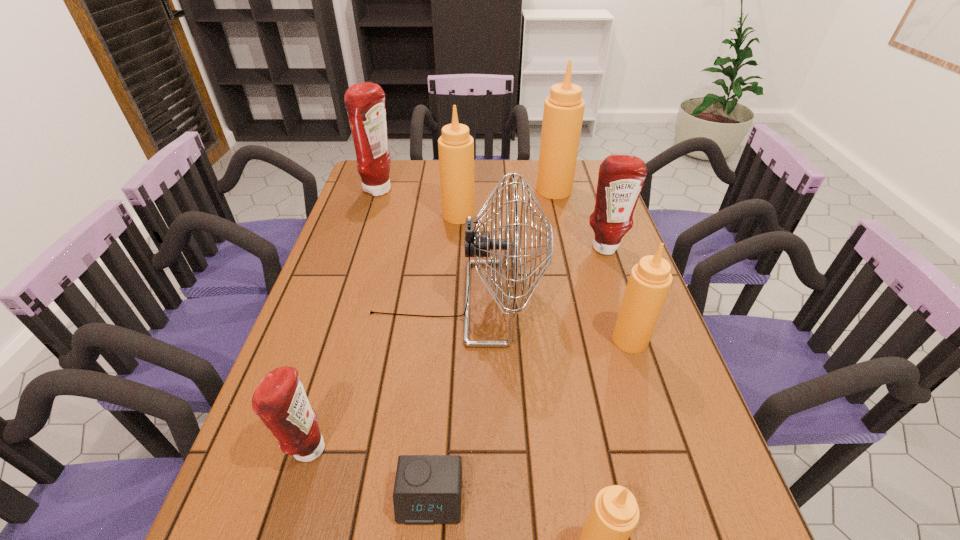
Identify the location of the nearest red condiment. The width and height of the screenshot is (960, 540). (280, 401).

Locate an element on the screen. the smallest red condiment is located at coordinates point(280,401).

The width and height of the screenshot is (960, 540). In order to click on the shortest object in this screenshot , I will do `click(427, 490)`.

Where is `the second nearest object`? the second nearest object is located at coordinates (427, 490).

The width and height of the screenshot is (960, 540). I want to click on free region located on the front of the tallest object, so click(x=567, y=248).

In order to click on vacant space situated on the left of the third condiment from left to right in this screenshot , I will do point(404,215).

Identify the location of vacant space located on the back of the biggest red condiment. click(x=389, y=161).

The height and width of the screenshot is (540, 960). I want to click on blank area located 0.090m on the front-facing side of the fan, so click(x=576, y=302).

Locate an element on the screen. blank space located 0.160m on the back of the second nearest red condiment is located at coordinates (592, 210).

This screenshot has height=540, width=960. In order to click on vacant space located 0.360m on the front of the second smallest tan condiment in this screenshot , I will do click(x=686, y=513).